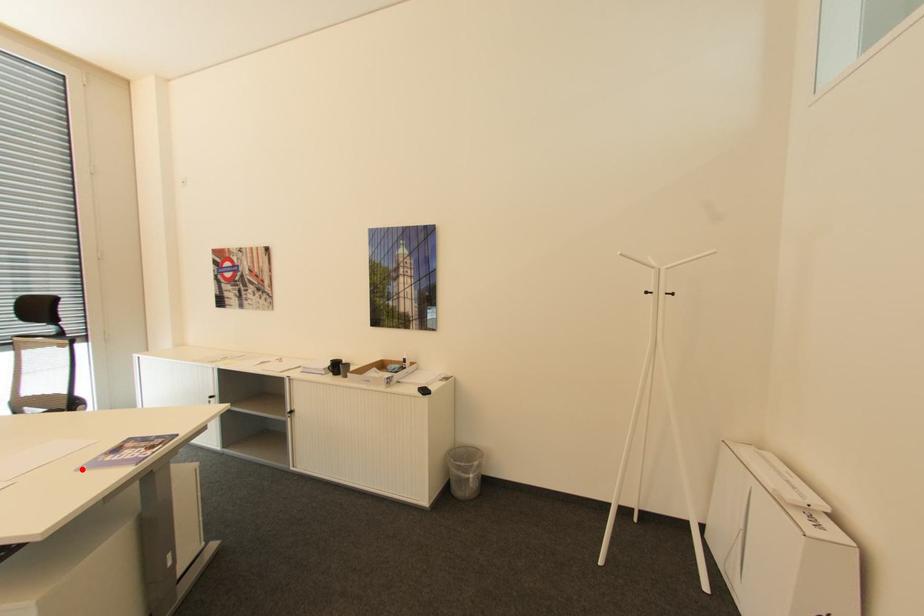
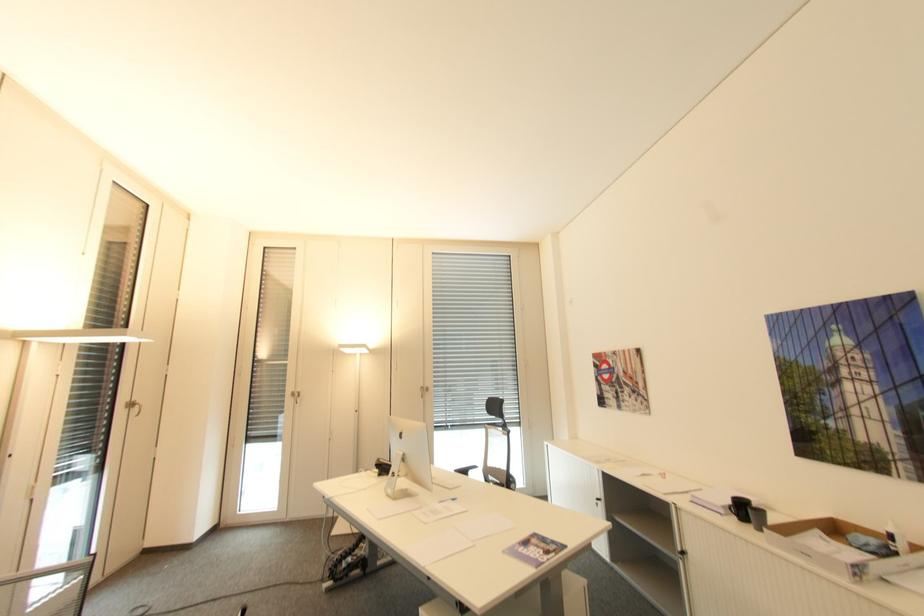
Find the pixel in the second image that matches the highlighted location in the first image.

(507, 553)